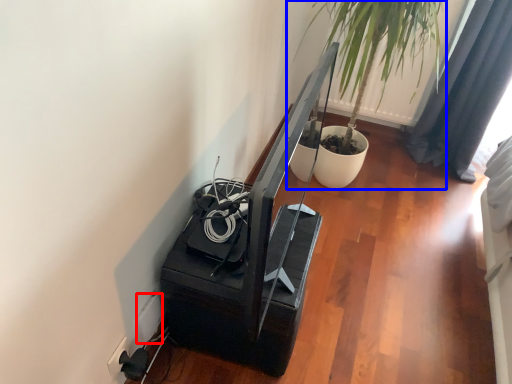
Question: Which point is further to the camera, electric outlet (highlighted by a red box) or houseplant (highlighted by a blue box)?

Choices:
 (A) electric outlet
 (B) houseplant

Answer: (B)